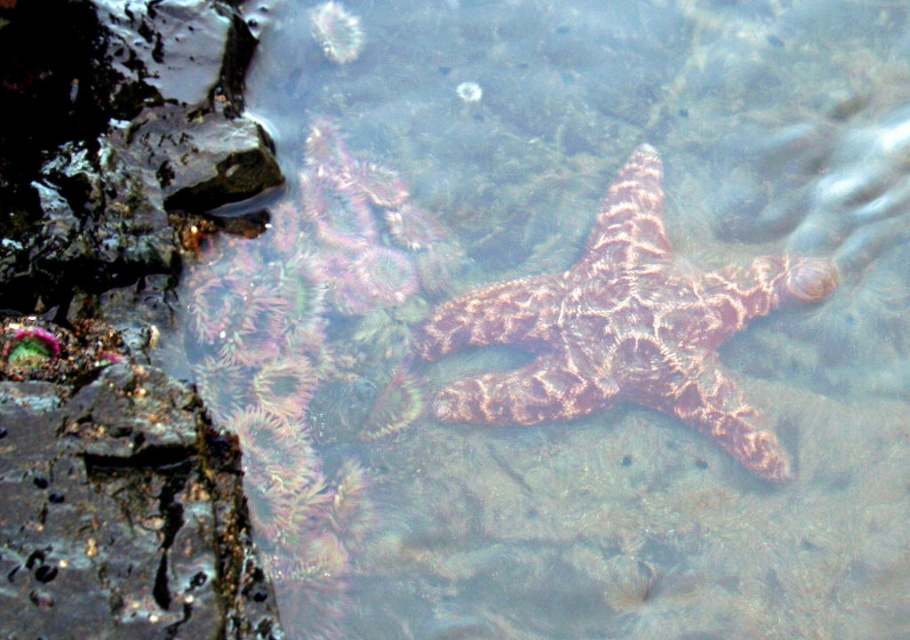
Is rusty metallic rock at left wider than rusty textured starfish at center?

No.

Which is behind, point (18, 396) or point (666, 253)?

The point (666, 253) is behind.

I want to click on rusty metallic rock at left, so 123,515.